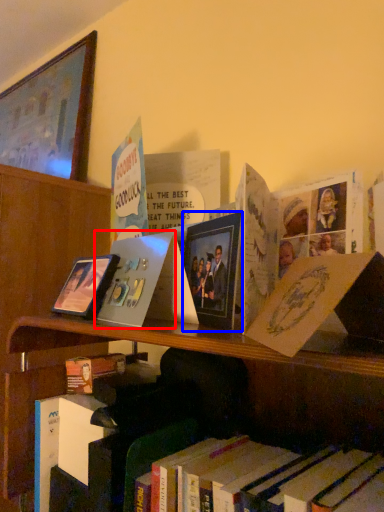
Question: Which point is closer to the camera, paperback book (highlighted by a red box) or picture frame (highlighted by a blue box)?

Choices:
 (A) paperback book
 (B) picture frame

Answer: (B)